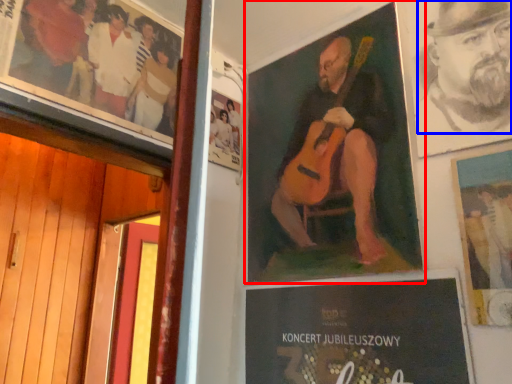
Question: Among these objects, which one is farthest to the camera, poster (highlighted by a red box) or person (highlighted by a blue box)?

Choices:
 (A) poster
 (B) person

Answer: (A)